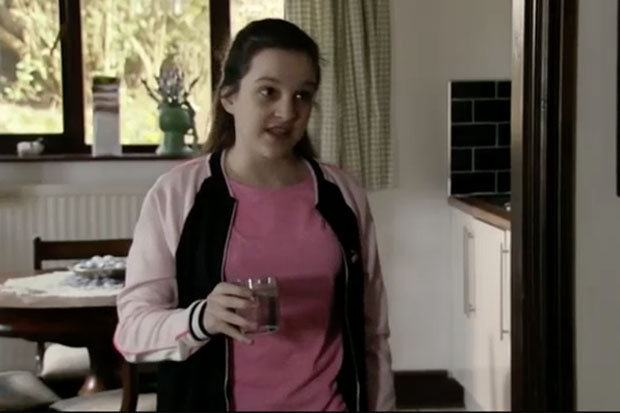
Where is `window frame`? window frame is located at coordinates (71, 61), (218, 15).